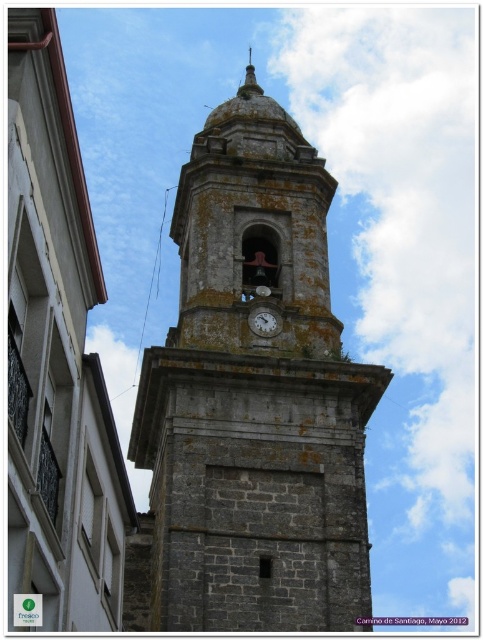
Does gray stone clock tower at center appear on the left side of gold textured spire at upper center?

Indeed, gray stone clock tower at center is positioned on the left side of gold textured spire at upper center.

Is gray stone clock tower at center wider than gold textured spire at upper center?

Indeed, gray stone clock tower at center has a greater width compared to gold textured spire at upper center.

What do you see at coordinates (252, 401) in the screenshot?
I see `gray stone clock tower at center` at bounding box center [252, 401].

I want to click on gray stone clock tower at center, so click(x=252, y=401).

Can you confirm if gray stone clock tower at center is thinner than matte gray clock at center?

No, gray stone clock tower at center is not thinner than matte gray clock at center.

Find the location of a particular element. gray stone clock tower at center is located at coordinates (252, 401).

Describe the element at coordinates (252, 401) in the screenshot. I see `gray stone clock tower at center` at that location.

At what (x,y) coordinates should I click in order to perform the action: click on gray stone clock tower at center. Please return your answer as a coordinate pair (x, y). This screenshot has height=640, width=483. Looking at the image, I should click on (252, 401).

Who is taller, matte gray clock at center or gold textured spire at upper center?

Standing taller between the two is gold textured spire at upper center.

Identify the location of matte gray clock at center. Image resolution: width=483 pixels, height=640 pixels. (265, 321).

This screenshot has height=640, width=483. I want to click on matte gray clock at center, so click(x=265, y=321).